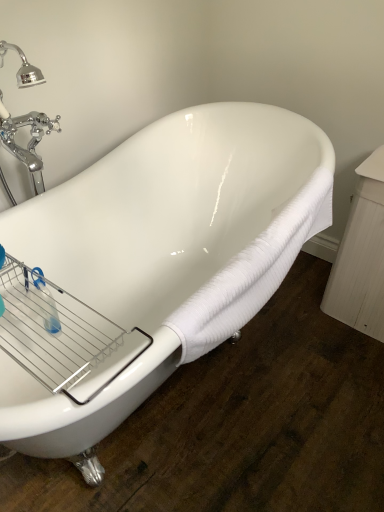
Question: Should I look upward or downward to see white glossy bathtub at center?

Choices:
 (A) up
 (B) down

Answer: (B)